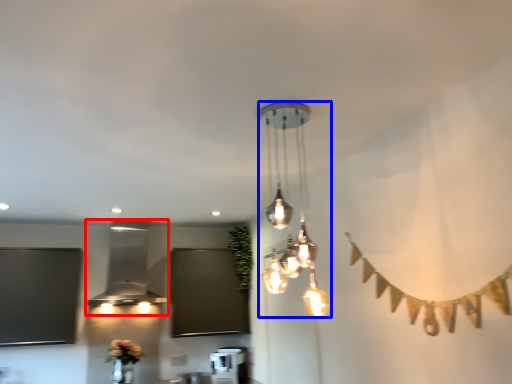
Question: Which point is closer to the camera, lamp (highlighted by a red box) or lamp (highlighted by a blue box)?

Choices:
 (A) lamp
 (B) lamp

Answer: (B)